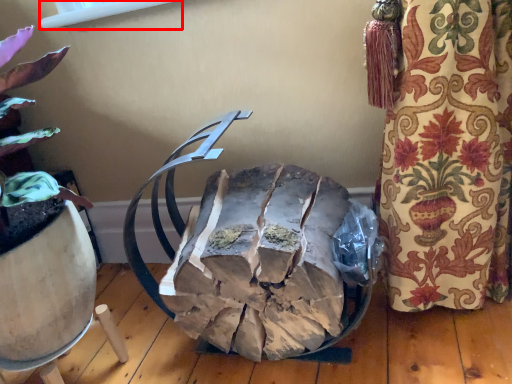
Question: From the image's perspective, what is the correct spatial relationship of window screen (annotated by the red box) in relation to waste?

Choices:
 (A) above
 (B) below

Answer: (A)